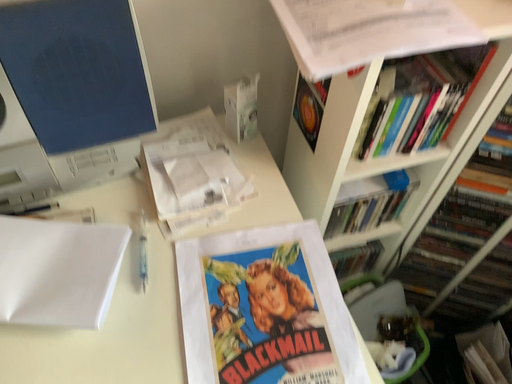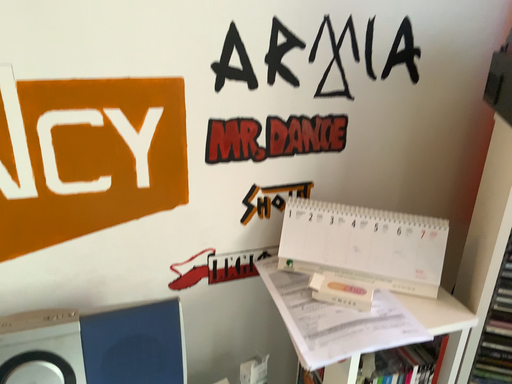
Question: Which way did the camera rotate in the video?

Choices:
 (A) rotated upward
 (B) rotated downward

Answer: (A)